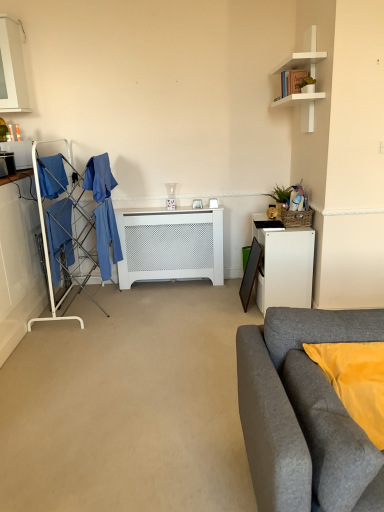
Question: From the image's perspective, would you say green matte plant at upper right, the 2th houseplant positioned from the back, is shown under green woven basket at upper right, marked as the first houseplant in a bottom-to-top arrangement?

Choices:
 (A) no
 (B) yes

Answer: (A)

Question: From a real-world perspective, is green matte plant at upper right, which is the first houseplant from front to back, positioned over green woven basket at upper right, the 2th houseplant in the top-to-bottom sequence, based on gravity?

Choices:
 (A) no
 (B) yes

Answer: (B)

Question: Would you say green matte plant at upper right, the 1th houseplant when ordered from top to bottom, contains green woven basket at upper right, acting as the first houseplant starting from the back?

Choices:
 (A) no
 (B) yes

Answer: (A)

Question: Is green matte plant at upper right, which is the 2th houseplant from bottom to top, looking in the opposite direction of green woven basket at upper right, acting as the first houseplant starting from the back?

Choices:
 (A) yes
 (B) no

Answer: (B)

Question: Does green matte plant at upper right, which is the 2th houseplant from bottom to top, turn towards green woven basket at upper right, marked as the first houseplant in a bottom-to-top arrangement?

Choices:
 (A) yes
 (B) no

Answer: (B)

Question: Is point click(x=102, y=258) positioned closer to the camera than point click(x=13, y=158)?

Choices:
 (A) farther
 (B) closer

Answer: (A)

Question: From a real-world perspective, is blue fabric drying rack at left physically located above or below matte black microwave at left?

Choices:
 (A) below
 (B) above

Answer: (A)

Question: Is blue fabric drying rack at left wider or thinner than matte black microwave at left?

Choices:
 (A) wide
 (B) thin

Answer: (A)

Question: Which is correct: blue fabric drying rack at left is inside matte black microwave at left, or outside of it?

Choices:
 (A) outside
 (B) inside

Answer: (A)

Question: From a real-world perspective, is matte black picture frame at right above or below white matte radiator at center?

Choices:
 (A) above
 (B) below

Answer: (B)

Question: From the image's perspective, is matte black picture frame at right positioned above or below white matte radiator at center?

Choices:
 (A) above
 (B) below

Answer: (B)

Question: Is point (243, 308) closer or farther from the camera than point (148, 240)?

Choices:
 (A) closer
 (B) farther

Answer: (A)

Question: Relative to white matte radiator at center, is matte black picture frame at right in front or behind?

Choices:
 (A) behind
 (B) front

Answer: (B)

Question: Which is correct: gray fabric couch at lower right is inside matte black microwave at left, or outside of it?

Choices:
 (A) inside
 (B) outside

Answer: (B)

Question: From a real-world perspective, relative to matte black microwave at left, is gray fabric couch at lower right vertically above or below?

Choices:
 (A) below
 (B) above

Answer: (A)